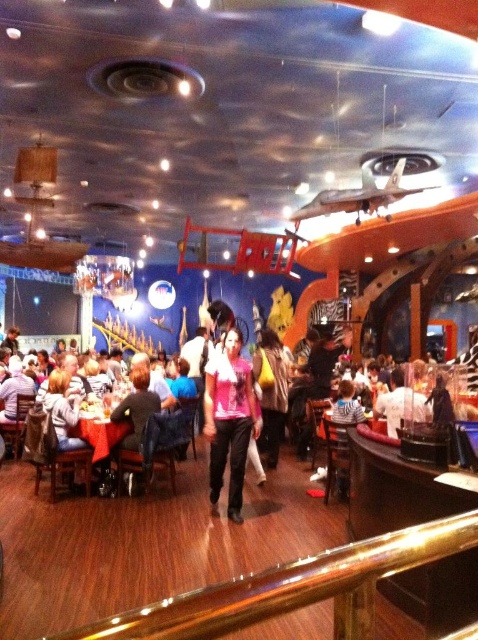
Question: Which of the following is the farthest from the observer?

Choices:
 (A) pink fabric shirt at center
 (B) shiny polished wood rail at lower center

Answer: (A)

Question: Which object is closer to the camera taking this photo?

Choices:
 (A) shiny polished wood rail at lower center
 (B) pink fabric shirt at center

Answer: (A)

Question: Can you confirm if pink fabric shirt at center is bigger than red tablecloth at lower left?

Choices:
 (A) no
 (B) yes

Answer: (B)

Question: Which of the following is the closest to the observer?

Choices:
 (A) red tablecloth at lower left
 (B) shiny polished wood rail at lower center
 (C) pink fabric shirt at center

Answer: (B)

Question: Is pink fabric shirt at center positioned before red tablecloth at lower left?

Choices:
 (A) yes
 (B) no

Answer: (A)

Question: Can you confirm if pink fabric shirt at center is positioned to the left of red tablecloth at lower left?

Choices:
 (A) yes
 (B) no

Answer: (B)